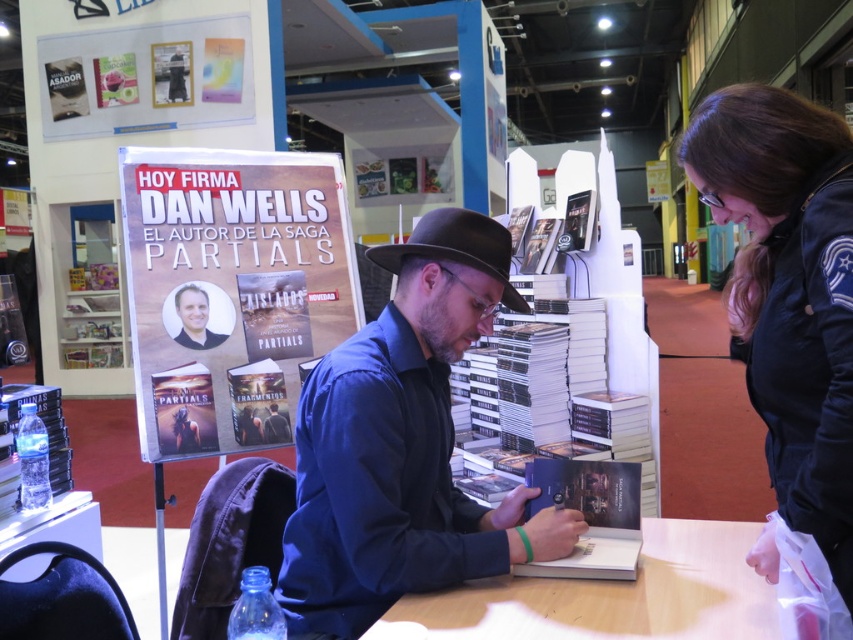
Question: Which of the following is the farthest from the observer?

Choices:
 (A) black felt fedora at center
 (B) hardcover book at center
 (C) clear plastic water bottle at lower left

Answer: (C)

Question: Observing the image, what is the correct spatial positioning of matte paper poster at center in reference to wooden table at center?

Choices:
 (A) above
 (B) below

Answer: (A)

Question: Does blue cotton shirt at center lie behind clear plastic water bottle at lower left?

Choices:
 (A) yes
 (B) no

Answer: (B)

Question: Considering the real-world distances, which object is closest to the black leather jacket at lower right?

Choices:
 (A) wooden table at center
 (B) matte paper poster at center

Answer: (A)

Question: Does matte paper poster at center appear over black leather jacket at lower right?

Choices:
 (A) no
 (B) yes

Answer: (B)

Question: Which point is farther to the camera?

Choices:
 (A) (656, 605)
 (B) (231, 80)
 (C) (750, 374)

Answer: (B)